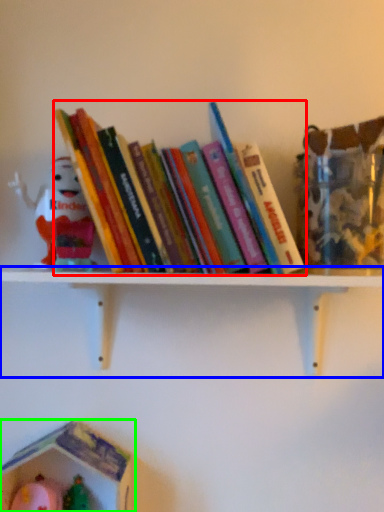
Question: Which object is the farthest from book (highlighted by a red box)? Choose among these: shelf (highlighted by a blue box) or toy (highlighted by a green box).

Choices:
 (A) shelf
 (B) toy

Answer: (B)